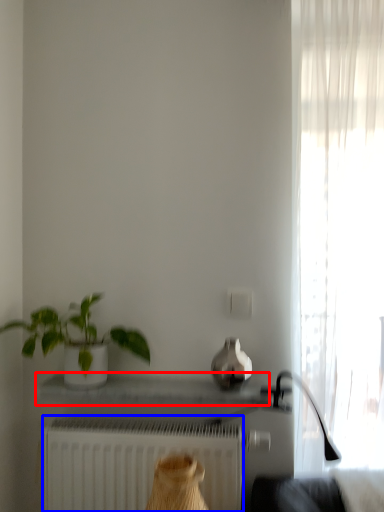
Question: Which object is closer to the camera taking this photo, window sill (highlighted by a red box) or radiator (highlighted by a blue box)?

Choices:
 (A) window sill
 (B) radiator

Answer: (A)